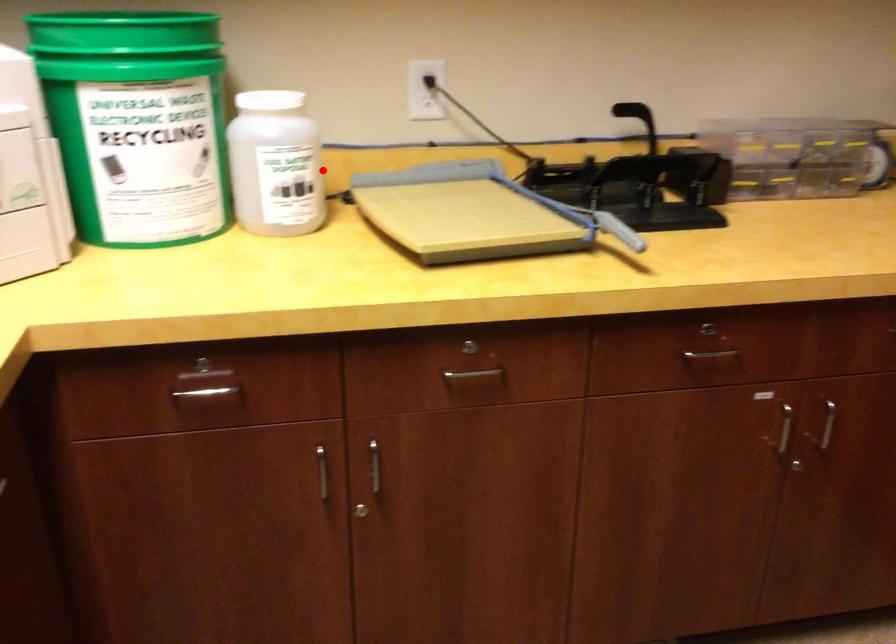
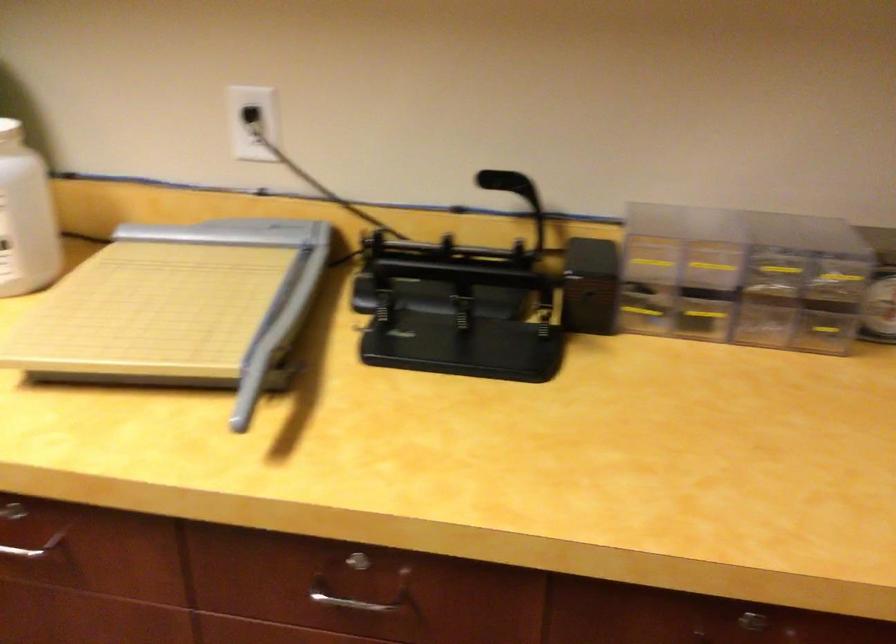
Question: I am providing you with two images of the same scene from different viewpoints. A red point is marked on the first image. Is the red point's position out of view in image 2?

Choices:
 (A) Yes
 (B) No

Answer: (B)